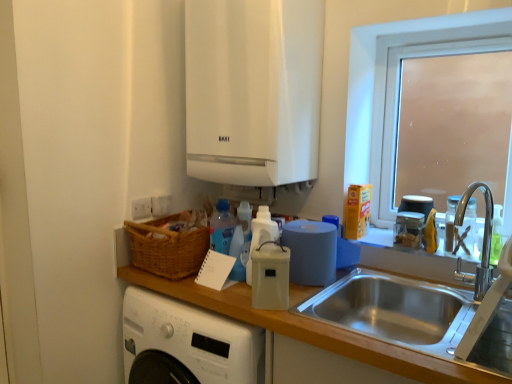
This screenshot has width=512, height=384. What are the coordinates of `free location above blue matte paper towel at right (from a real-world perspective)` in the screenshot? It's located at (310, 226).